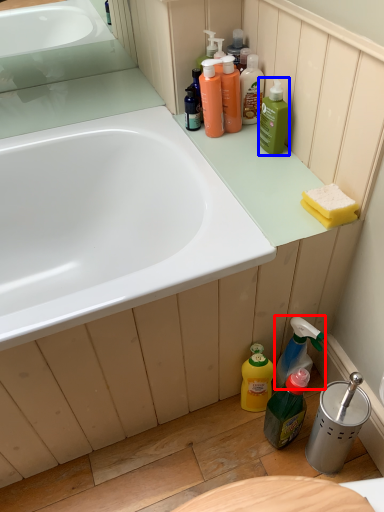
Question: Which point is further to the camera, cleaning product (highlighted by a red box) or cleaning product (highlighted by a blue box)?

Choices:
 (A) cleaning product
 (B) cleaning product

Answer: (B)